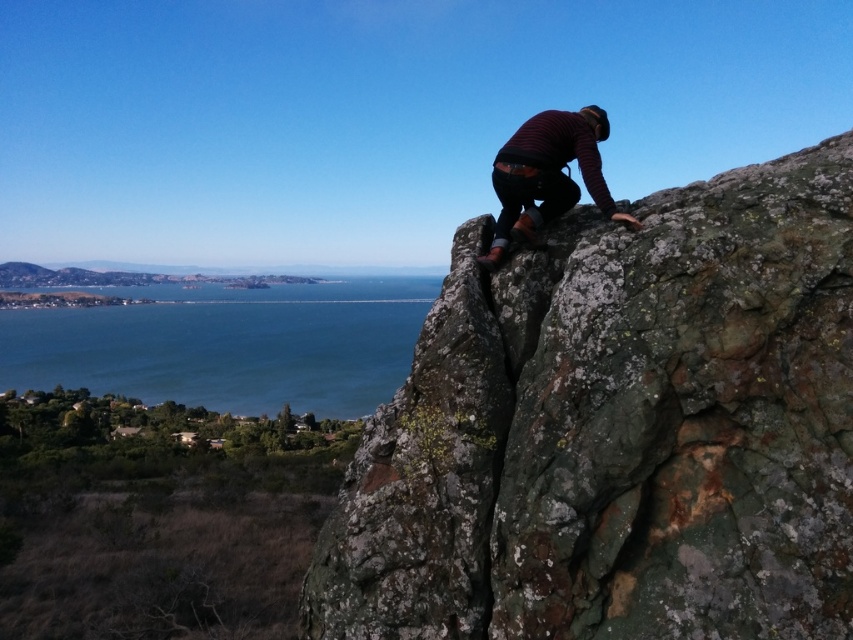
Looking at this image, you are a climber assessing the scene. You notice the rusty rock at upper right and the blue water at lower left. Which object occupies a smaller horizontal space in the image?

The rusty rock at upper right has a lesser width compared to the blue water at lower left, so the rusty rock at upper right occupies a smaller horizontal space.

You are a drone operator trying to capture the climber on the cliff. The climber is at the edge of the cliff, and you need to position your drone to get a clear shot of the climber while avoiding the rusty rock at upper right. According to the coordinates provided, where should you place the drone relative to the climber to avoid the rusty rock?

The rusty rock at upper right is located at coordinates (618, 432). To avoid it, position the drone below and to the left of the climber, ensuring it stays clear of the rock at those coordinates.

You are a photographer trying to capture the climber and the surrounding scenery. Since you want to include both the blue water at lower left and the striped wool sweater at upper right in your shot, which object should you focus on first to ensure both are in frame?

The blue water at lower left has a larger size compared to the striped wool sweater at upper right, so you should focus on the blue water at lower left first to ensure both are in frame.